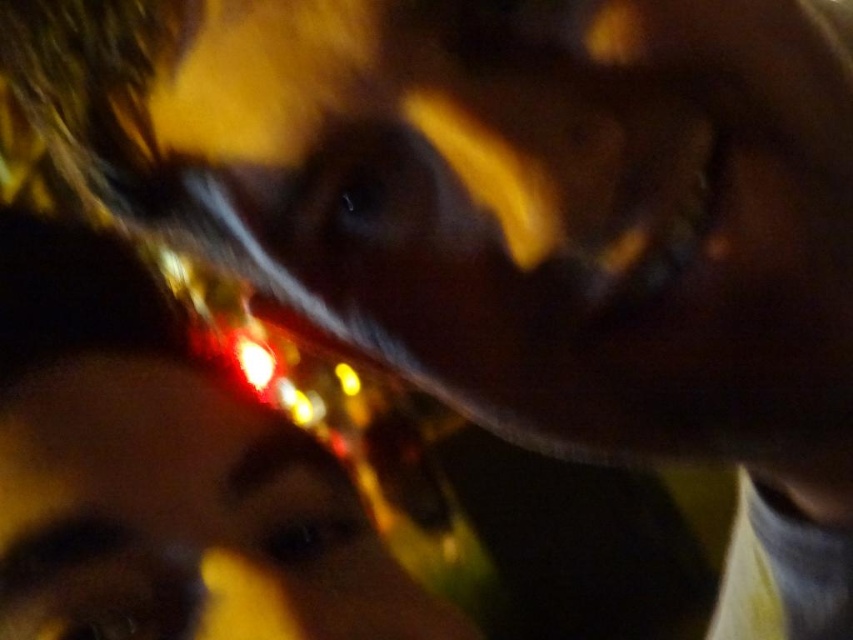
Question: In this image, where is glossy plastic face at center located relative to glossy plastic face at upper center?

Choices:
 (A) above
 (B) below

Answer: (A)

Question: Which object appears farthest from the camera in this image?

Choices:
 (A) glossy plastic face at center
 (B) glossy plastic face at upper center

Answer: (A)

Question: Which point appears farthest from the camera in this image?

Choices:
 (A) (259, 420)
 (B) (656, 348)

Answer: (A)

Question: Which point is closer to the camera?

Choices:
 (A) glossy plastic face at center
 (B) glossy plastic face at upper center

Answer: (B)

Question: Can you confirm if glossy plastic face at center is wider than glossy plastic face at upper center?

Choices:
 (A) no
 (B) yes

Answer: (B)

Question: Observing the image, what is the correct spatial positioning of glossy plastic face at center in reference to glossy plastic face at upper center?

Choices:
 (A) below
 (B) above

Answer: (B)